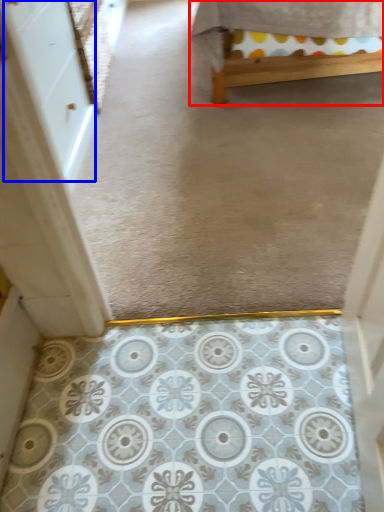
Question: Which object appears farthest to the camera in this image, furniture (highlighted by a red box) or screen door (highlighted by a blue box)?

Choices:
 (A) furniture
 (B) screen door

Answer: (A)